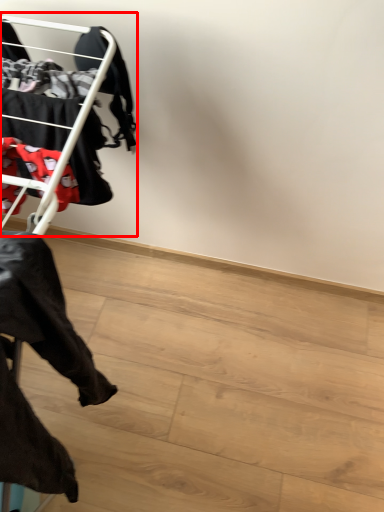
Question: From the image, what is the correct spatial relationship of bunk bed (annotated by the red box) in relation to furniture?

Choices:
 (A) left
 (B) right

Answer: (A)